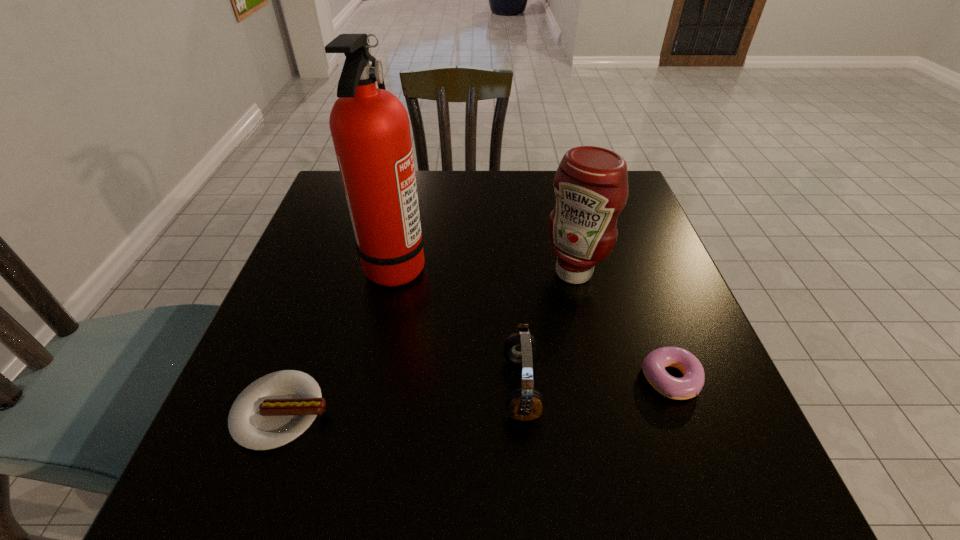
You are a GUI agent. You are given a task and a screenshot of the screen. Output one action in this format:
    pyautogui.click(x=<x>, y=<y>)
    Task: Click on the vacant area in the image that satisfies the following two spatial constraints: 1. on the back side of the second tallest object; 2. on the handle side of the fire extinguisher
    This screenshot has height=540, width=960.
    Given the screenshot: What is the action you would take?
    (x=572, y=265)